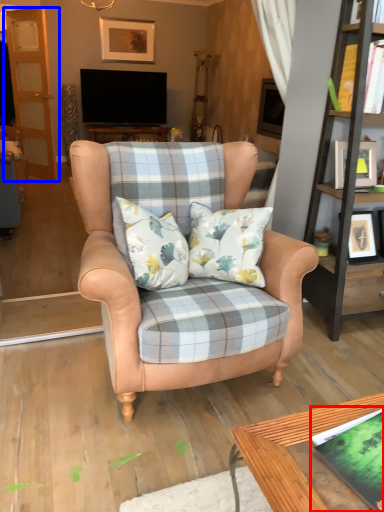
Question: Which object appears closest to the camera in this image, book (highlighted by a red box) or screen door (highlighted by a blue box)?

Choices:
 (A) book
 (B) screen door

Answer: (A)